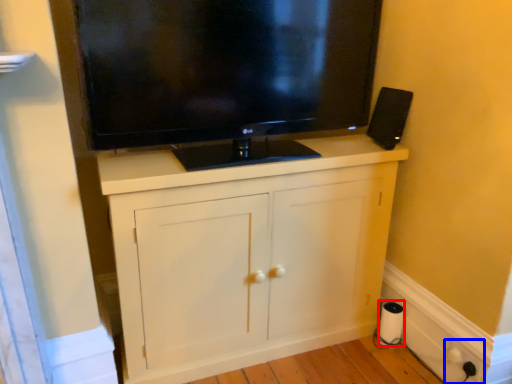
Question: Among these objects, which one is nearest to the camera, paper towel (highlighted by a red box) or electric outlet (highlighted by a blue box)?

Choices:
 (A) paper towel
 (B) electric outlet

Answer: (B)